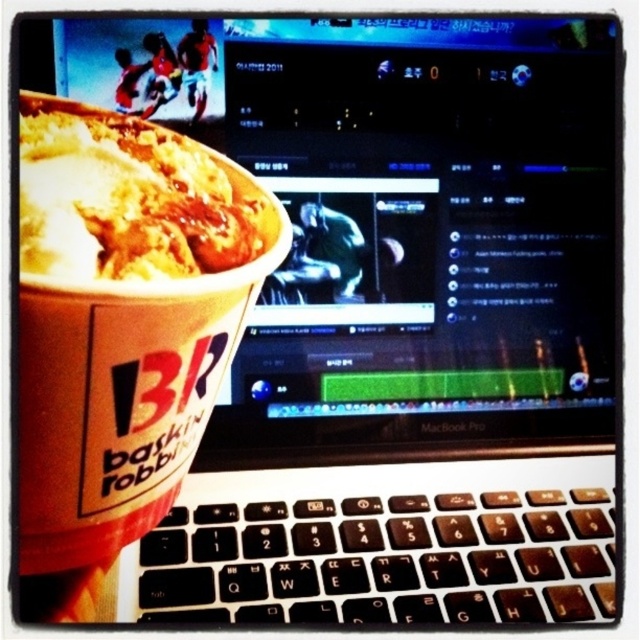
Question: Which of the following is the closest to the observer?

Choices:
 (A) pos(124,156)
 (B) pos(493,572)

Answer: (A)

Question: In this image, where is black plastic keyboard at center located relative to white creamy ice cream at left?

Choices:
 (A) below
 (B) above

Answer: (A)

Question: Can you confirm if black plastic keyboard at center is positioned below white creamy ice cream at left?

Choices:
 (A) yes
 (B) no

Answer: (A)

Question: Does black plastic keyboard at center have a greater width compared to white creamy ice cream at left?

Choices:
 (A) yes
 (B) no

Answer: (A)